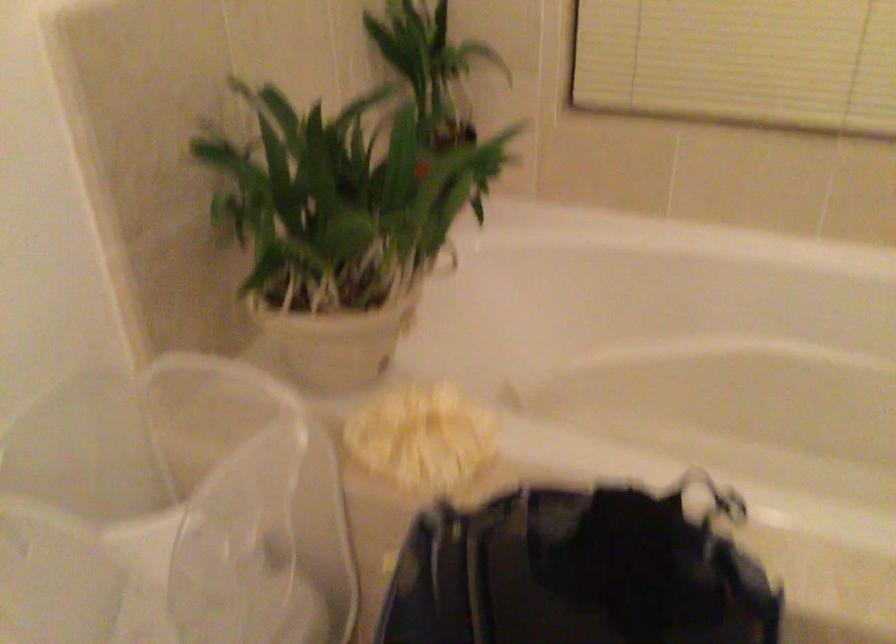
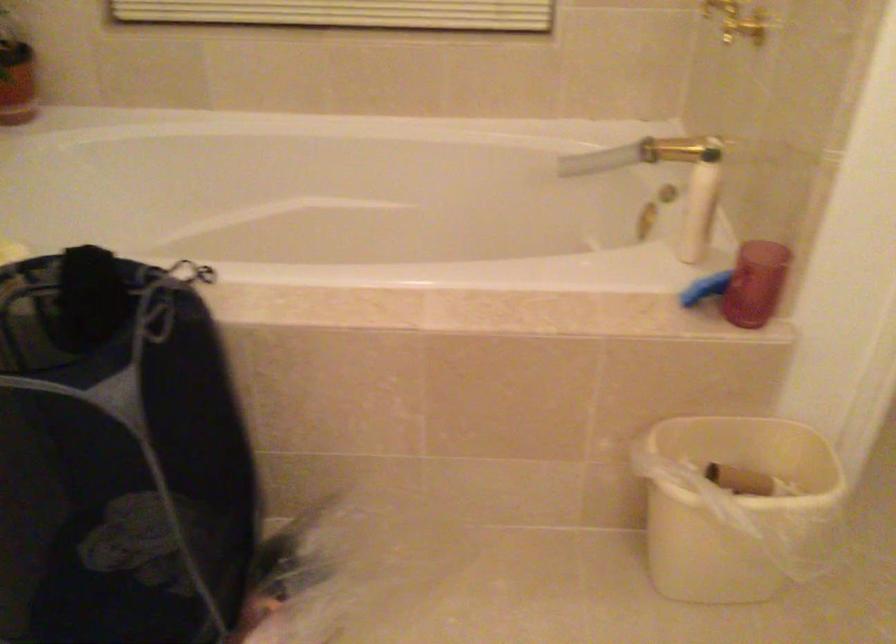
What movement of the cameraman would produce the second image?

The cameraman moved toward right, backward.